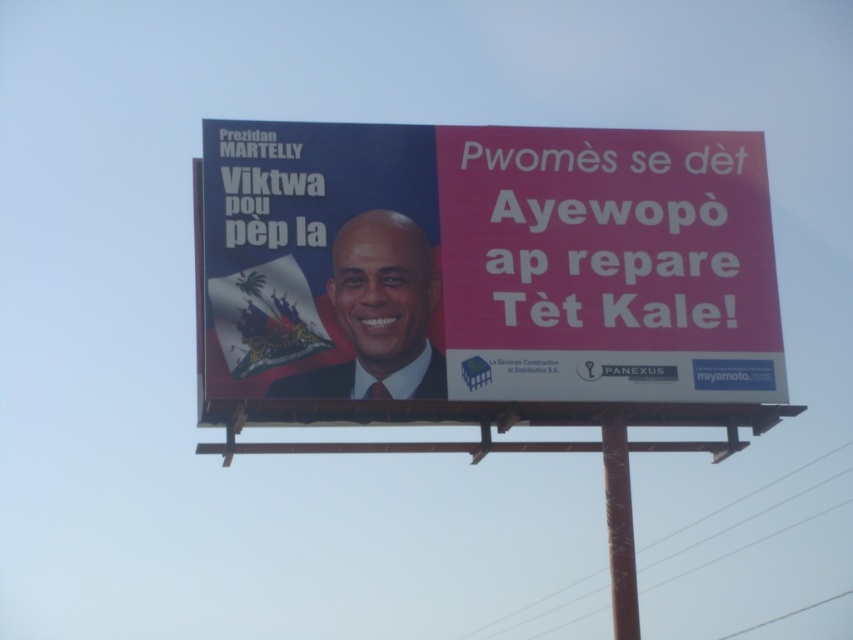
You are a painter who needs to determine which object is shorter between the matte plastic billboard at center and the metallic pole at center. Based on the scene description, which one should you paint first if you want to start with the shorter one?

The matte plastic billboard at center is not as tall as the metallic pole at center, so you should paint the matte plastic billboard at center first since it is shorter.